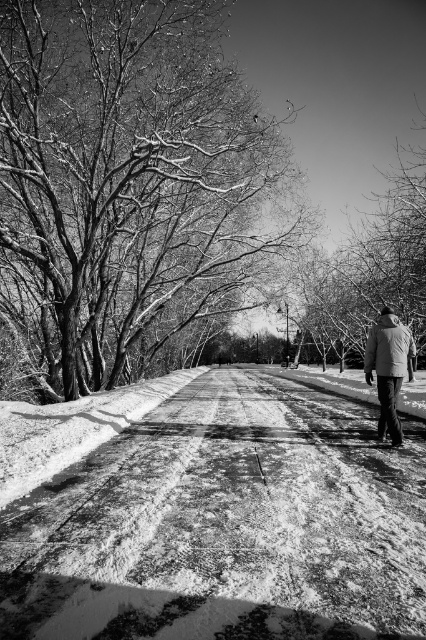
You are a photographer planning to capture the winter scene. You notice the bare branches at upper center and the coated fabric jacket at lower right. Which object would appear bigger in your photo?

The bare branches at upper center would appear bigger in the photo because they are larger in size than the coated fabric jacket at lower right.

Consider the image. You are navigating a small delivery robot that must stay on the snowy asphalt road at center. Given the coordinates provided, can you confirm if the robot is positioned correctly on the road?

The snowy asphalt road at center is located at point [224,525], so yes, the robot is positioned correctly on the road at those coordinates.